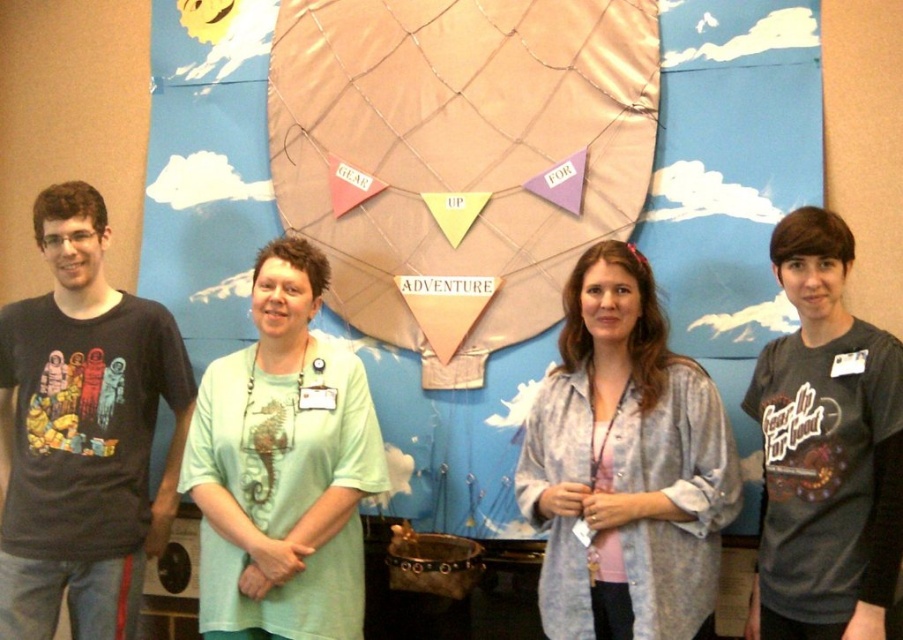
You are a photographer taking a picture of the scene. The pink fabric balloon at center and the light blue sheer shirt at center are both in the frame. Which object is closer to the camera?

The pink fabric balloon at center is closer to the camera because the light blue sheer shirt at center is behind it.

You are standing in front of the backdrop and want to take a photo of yourself with the pink fabric balloon at center. If your camera can focus on objects up to 10 feet away, will the balloon be in focus?

The pink fabric balloon at center is 9.86 feet away from the camera, which is within the camera focus range of up to 10 feet. Therefore, the balloon will be in focus.